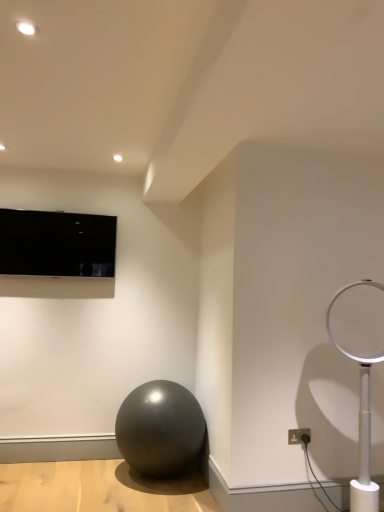
This screenshot has height=512, width=384. Describe the element at coordinates (57, 244) in the screenshot. I see `matte black tv at upper left` at that location.

You are a GUI agent. You are given a task and a screenshot of the screen. Output one action in this format:
    pyautogui.click(x=<x>, y=<y>)
    Task: Click on the matte black tv at upper left
    This screenshot has height=512, width=384.
    Given the screenshot: What is the action you would take?
    pyautogui.click(x=57, y=244)

From the image's perspective, is white plastic lamp at right on top of shiny black ball at center?

Indeed, from the image's perspective, white plastic lamp at right is shown above shiny black ball at center.

Find the location of a particular element. The height and width of the screenshot is (512, 384). lamp in front of the shiny black ball at center is located at coordinates (363, 393).

Considering the relative sizes of white plastic lamp at right and shiny black ball at center in the image provided, is white plastic lamp at right taller than shiny black ball at center?

Correct, white plastic lamp at right is much taller as shiny black ball at center.

In terms of size, does white plastic lamp at right appear bigger or smaller than shiny black ball at center?

Considering their sizes, white plastic lamp at right takes up less space than shiny black ball at center.

Who is shorter, shiny black ball at center or matte black tv at upper left?

Standing shorter between the two is matte black tv at upper left.

From the image's perspective, would you say shiny black ball at center is positioned over matte black tv at upper left?

No.

Does point (188, 402) come closer to viewer compared to point (83, 265)?

Yes, point (188, 402) is closer to viewer.

How far apart are shiny black ball at center and white plastic electric outlet at lower right?

The distance of shiny black ball at center from white plastic electric outlet at lower right is 35.10 inches.

From the image's perspective, is shiny black ball at center on white plastic electric outlet at lower right?

Incorrect, from the image's perspective, shiny black ball at center is lower than white plastic electric outlet at lower right.

Considering the sizes of objects shiny black ball at center and white plastic electric outlet at lower right in the image provided, who is thinner, shiny black ball at center or white plastic electric outlet at lower right?

Thinner between the two is white plastic electric outlet at lower right.

Considering the sizes of objects matte black tv at upper left and shiny black ball at center in the image provided, who is taller, matte black tv at upper left or shiny black ball at center?

shiny black ball at center.

Would you say matte black tv at upper left is a long distance from shiny black ball at center?

Yes, matte black tv at upper left and shiny black ball at center are quite far apart.

Which is closer, (41, 240) or (141, 472)?

The point (141, 472) is closer.

Identify the location of ball on the right of matte black tv at upper left. (160, 429).

Is white plastic electric outlet at lower right thinner than white plastic lamp at right?

Correct, the width of white plastic electric outlet at lower right is less than that of white plastic lamp at right.

Is point (294, 441) closer or farther from the camera than point (335, 344)?

Point (294, 441) is farther from the camera than point (335, 344).

Is white plastic electric outlet at lower right positioned with its back to white plastic lamp at right?

No, white plastic lamp at right is not at the back of white plastic electric outlet at lower right.

Would you say white plastic electric outlet at lower right contains white plastic lamp at right?

No.

From the image's perspective, is shiny black ball at center over white plastic lamp at right?

No, from the image's perspective, shiny black ball at center is not over white plastic lamp at right.

How different are the orientations of shiny black ball at center and white plastic lamp at right in degrees?

The facing directions of shiny black ball at center and white plastic lamp at right are 19.9 degrees apart.

Is shiny black ball at center oriented towards white plastic lamp at right?

No, shiny black ball at center is not facing towards white plastic lamp at right.

Is shiny black ball at center in contact with white plastic lamp at right?

shiny black ball at center is not next to white plastic lamp at right, and they're not touching.

Considering the positions of point (305, 429) and point (130, 465), is point (305, 429) closer or farther from the camera than point (130, 465)?

Clearly, point (305, 429) is closer to the camera than point (130, 465).

Which is more to the left, white plastic electric outlet at lower right or shiny black ball at center?

Positioned to the left is shiny black ball at center.

Does white plastic electric outlet at lower right have a larger size compared to shiny black ball at center?

No.

Considering the relative sizes of white plastic electric outlet at lower right and shiny black ball at center in the image provided, is white plastic electric outlet at lower right shorter than shiny black ball at center?

Yes.

What are the coordinates of `ball below the white plastic lamp at right (from a real-world perspective)` in the screenshot? It's located at (160, 429).

I want to click on television lying above the shiny black ball at center (from the image's perspective), so click(57, 244).

From the image, which object appears to be farther from white plastic electric outlet at lower right, shiny black ball at center or matte black tv at upper left?

matte black tv at upper left.

Looking at this image, based on their spatial positions, is shiny black ball at center or white plastic electric outlet at lower right further from matte black tv at upper left?

white plastic electric outlet at lower right is positioned further to the anchor matte black tv at upper left.

Based on the photo, estimate the real-world distances between objects in this image. Which object is further from white plastic lamp at right, white plastic electric outlet at lower right or matte black tv at upper left?

matte black tv at upper left is positioned further to the anchor white plastic lamp at right.

Based on their spatial positions, is shiny black ball at center or white plastic electric outlet at lower right further from white plastic lamp at right?

Among the two, shiny black ball at center is located further to white plastic lamp at right.

Which object lies nearer to the anchor point shiny black ball at center, matte black tv at upper left or white plastic electric outlet at lower right?

white plastic electric outlet at lower right is positioned closer to the anchor shiny black ball at center.

From the image, which object appears to be nearer to matte black tv at upper left, shiny black ball at center or white plastic lamp at right?

The object closer to matte black tv at upper left is shiny black ball at center.

In the scene shown: From the image, which object appears to be nearer to shiny black ball at center, white plastic electric outlet at lower right or white plastic lamp at right?

white plastic electric outlet at lower right is positioned closer to the anchor shiny black ball at center.

Based on their spatial positions, is matte black tv at upper left or shiny black ball at center further from white plastic lamp at right?

matte black tv at upper left is positioned further to the anchor white plastic lamp at right.

Identify the location of ball situated between matte black tv at upper left and white plastic electric outlet at lower right from left to right. (160, 429).

Locate an element on the screen. This screenshot has height=512, width=384. electric outlet between matte black tv at upper left and white plastic lamp at right is located at coordinates (299, 436).

The width and height of the screenshot is (384, 512). I want to click on electric outlet situated between shiny black ball at center and white plastic lamp at right from left to right, so click(299, 436).

This screenshot has height=512, width=384. What are the coordinates of `ball between matte black tv at upper left and white plastic lamp at right in the horizontal direction` in the screenshot? It's located at (160, 429).